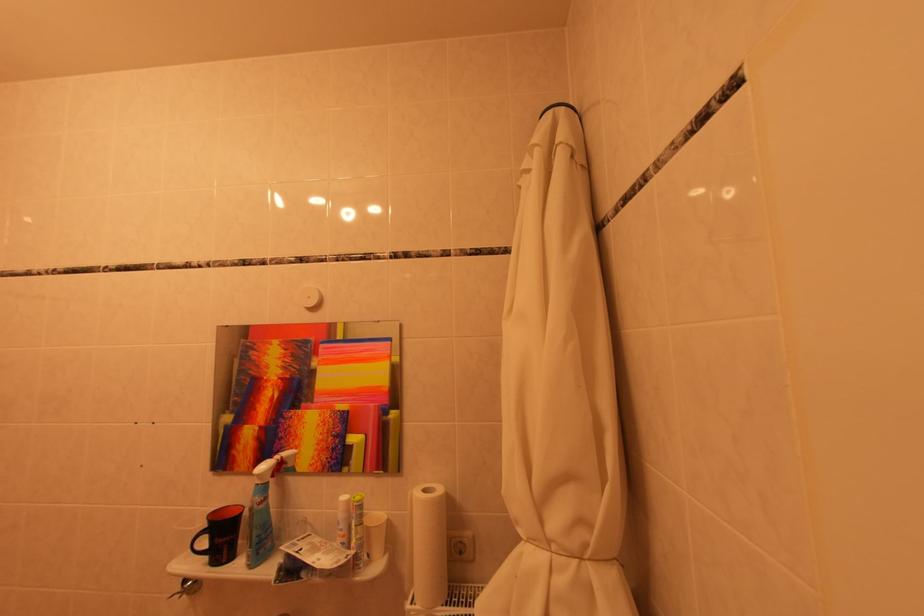
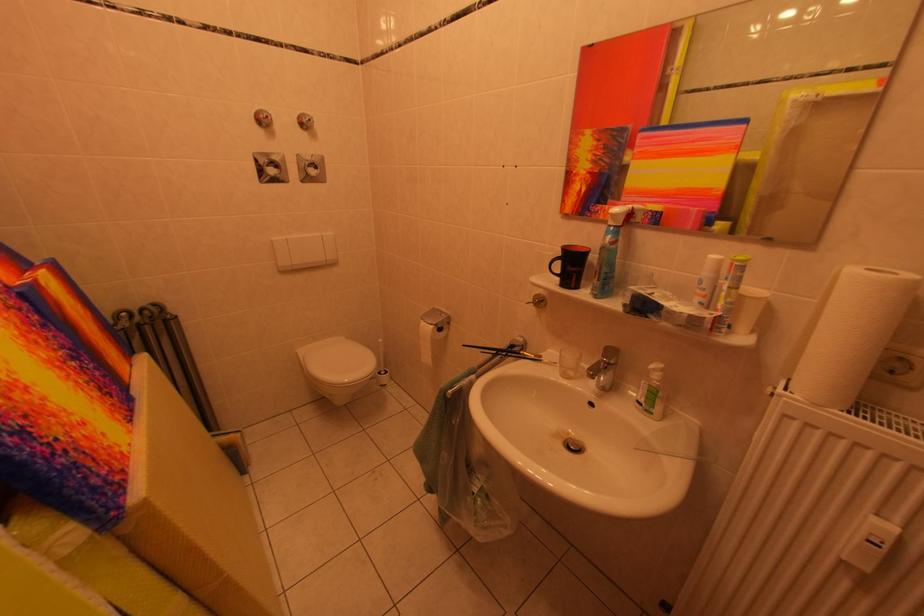
Find the pixel in the second image that matches [264,544] in the first image.

(613, 280)